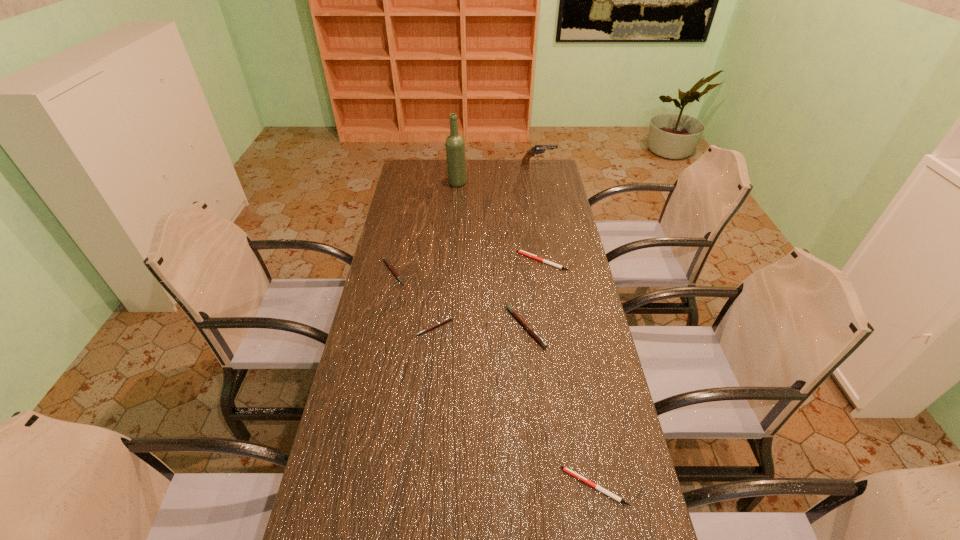
Image resolution: width=960 pixels, height=540 pixels. In order to click on the tallest object in this screenshot , I will do `click(455, 151)`.

Identify the location of the second farthest object. click(455, 151).

Locate an element on the screen. the farthest object is located at coordinates (530, 153).

Where is `black gun`? The height and width of the screenshot is (540, 960). black gun is located at coordinates (530, 153).

Where is `the rightmost pink pen`? The height and width of the screenshot is (540, 960). the rightmost pink pen is located at coordinates (536, 336).

Where is `the fifth shortest object`? The image size is (960, 540). the fifth shortest object is located at coordinates (536, 336).

Where is `the leftmost object`? The image size is (960, 540). the leftmost object is located at coordinates (385, 259).

Locate an element on the screen. This screenshot has width=960, height=540. the leftmost pink pen is located at coordinates (385, 259).

You are a GUI agent. You are given a task and a screenshot of the screen. Output one action in this format:
    pyautogui.click(x=<x>, y=<y>)
    Task: Click on the bigger white pen
    This screenshot has width=960, height=540.
    Given the screenshot: What is the action you would take?
    pyautogui.click(x=522, y=252)

Find the location of a particular element. Image resolution: width=960 pixels, height=540 pixels. the fourth pen from right to left is located at coordinates (450, 318).